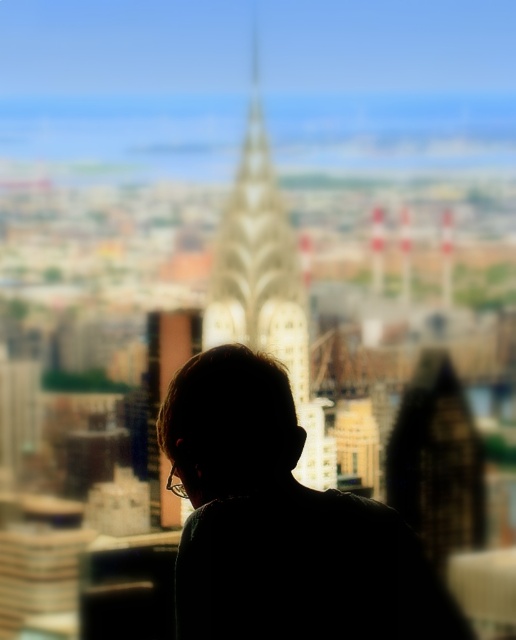
You are standing at the point with coordinates point (328, 454) and want to move to point (357, 454). Given that you can only move forward or backward along the same vertical line, which direction should you move to reach your destination?

You should move backward because point (328, 454) is in front of point (357, 454), so to reach the latter, you need to move backward along the vertical line.

You are an architect evaluating the cityscape. You notice the silhouette hair at center and the white marble tower at center. Which object is taller in the image?

The white marble tower at center is taller than the silhouette hair at center.

You are a city planner analyzing the layout of this cityscape. The point marked at coordinates (x=266, y=288) is labeled as the white marble tower at center. Based on the scene description, where would you expect this tower to be located relative to the person?

The point marked at coordinates (x=266, y=288) marks the white marble tower at center, so it is located directly in front of the person since the person is facing the cityscape and the tower is at the center of the scene.